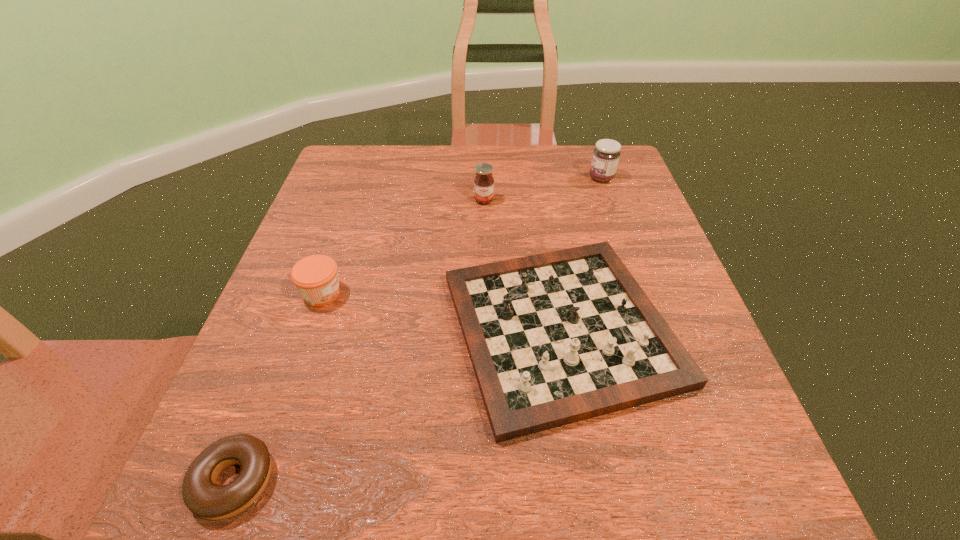
At what (x,y) coordinates should I click in order to perform the action: click on vacant point located on the front label of the rightmost jam. Please return your answer as a coordinate pair (x, y). This screenshot has width=960, height=540. Looking at the image, I should click on (515, 178).

The height and width of the screenshot is (540, 960). What are the coordinates of `vacant space located on the label side of the second farthest jam` in the screenshot? It's located at (485, 241).

The width and height of the screenshot is (960, 540). I want to click on vacant space located 0.050m on the back of the chessboard, so click(x=545, y=235).

This screenshot has height=540, width=960. I want to click on vacant space positioned on the front label of the leftmost jam, so click(x=422, y=294).

You are a GUI agent. You are given a task and a screenshot of the screen. Output one action in this format:
    pyautogui.click(x=<x>, y=<y>)
    Task: Click on the free region located 0.120m on the right of the doughnut
    This screenshot has width=960, height=540.
    Given the screenshot: What is the action you would take?
    pyautogui.click(x=362, y=481)

The height and width of the screenshot is (540, 960). I want to click on object situated at the near edge, so click(201, 495).

Where is `jam that is positioned at the left edge`? jam that is positioned at the left edge is located at coordinates (315, 276).

You are a GUI agent. You are given a task and a screenshot of the screen. Output one action in this format:
    pyautogui.click(x=<x>, y=<y>)
    Task: Click on the doughnut that is at the left edge
    Image resolution: width=960 pixels, height=540 pixels.
    Given the screenshot: What is the action you would take?
    pyautogui.click(x=201, y=495)

Identify the location of jam located at the right edge. The image size is (960, 540). click(606, 154).

This screenshot has width=960, height=540. In order to click on chessboard at the right edge in this screenshot , I will do `click(555, 338)`.